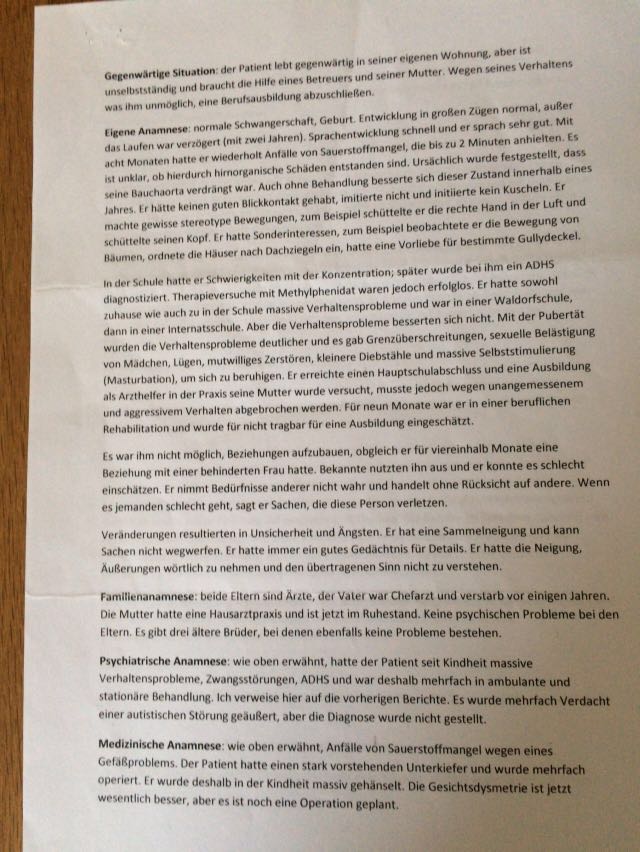
In order to click on surface in this screenshot , I will do `click(310, 6)`, `click(16, 308)`.